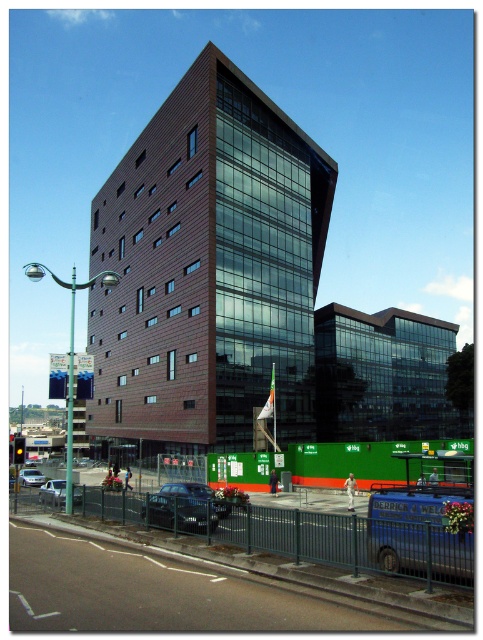
Consider the image. Is silver metallic car at lower left positioned behind silver metallic car at center?

No, it is not.

Between silver metallic car at lower left and silver metallic car at center, which one appears on the left side from the viewer's perspective?

Positioned to the left is silver metallic car at center.

The height and width of the screenshot is (640, 483). In order to click on silver metallic car at lower left in this screenshot , I will do `click(53, 492)`.

How much distance is there between shiny black car at center and silver metallic car at center?

They are 28.04 meters apart.

Between point (170, 484) and point (29, 468), which one is positioned in front?

Point (170, 484)

Is point (193, 532) closer to viewer compared to point (24, 477)?

Yes, it is in front of point (24, 477).

Locate an element on the screen. This screenshot has width=483, height=640. shiny black car at center is located at coordinates (184, 508).

Who is more forward, (156,522) or (60,486)?

Point (156,522) is in front.

Between shiny black car at center and silver metallic car at lower left, which one is positioned lower?

silver metallic car at lower left is below.

Image resolution: width=483 pixels, height=640 pixels. In order to click on shiny black car at center in this screenshot , I will do `click(184, 508)`.

You are a GUI agent. You are given a task and a screenshot of the screen. Output one action in this format:
    pyautogui.click(x=<x>, y=<y>)
    Task: Click on the shiny black car at center
    This screenshot has width=483, height=640.
    Given the screenshot: What is the action you would take?
    pyautogui.click(x=184, y=508)